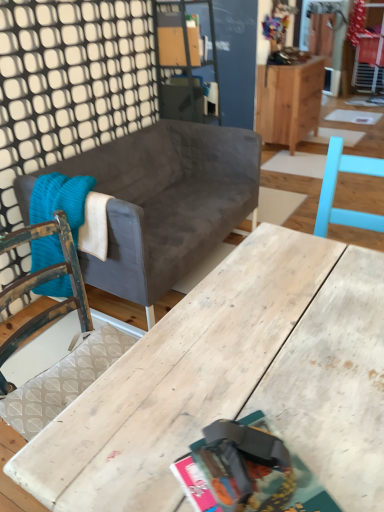
Question: From a real-world perspective, is wooden cabinet at upper right positioned over velvet gray couch at center based on gravity?

Choices:
 (A) no
 (B) yes

Answer: (B)

Question: Is wooden cabinet at upper right to the right of velvet gray couch at center from the viewer's perspective?

Choices:
 (A) no
 (B) yes

Answer: (B)

Question: From the image's perspective, is wooden cabinet at upper right located beneath velvet gray couch at center?

Choices:
 (A) yes
 (B) no

Answer: (B)

Question: Considering the relative sizes of wooden cabinet at upper right and velvet gray couch at center in the image provided, is wooden cabinet at upper right smaller than velvet gray couch at center?

Choices:
 (A) no
 (B) yes

Answer: (B)

Question: Is wooden cabinet at upper right aimed at velvet gray couch at center?

Choices:
 (A) yes
 (B) no

Answer: (B)

Question: From their relative heights in the image, would you say matte paper magazine at center is taller or shorter than wooden cabinet at upper right?

Choices:
 (A) tall
 (B) short

Answer: (B)

Question: Which is correct: matte paper magazine at center is inside wooden cabinet at upper right, or outside of it?

Choices:
 (A) outside
 (B) inside

Answer: (A)

Question: Does point (258, 423) appear closer or farther from the camera than point (268, 86)?

Choices:
 (A) closer
 (B) farther

Answer: (A)

Question: From the image's perspective, is matte paper magazine at center above or below wooden cabinet at upper right?

Choices:
 (A) below
 (B) above

Answer: (A)

Question: Considering the relative positions of knitted wool blanket at left and wooden table at center in the image provided, is knitted wool blanket at left to the left or to the right of wooden table at center?

Choices:
 (A) right
 (B) left

Answer: (B)

Question: Considering their positions, is knitted wool blanket at left located in front of or behind wooden table at center?

Choices:
 (A) behind
 (B) front

Answer: (A)

Question: From the image's perspective, is knitted wool blanket at left positioned above or below wooden table at center?

Choices:
 (A) above
 (B) below

Answer: (A)

Question: From a real-world perspective, is knitted wool blanket at left above or below wooden table at center?

Choices:
 (A) above
 (B) below

Answer: (A)

Question: Considering the positions of point (306, 133) and point (236, 159), is point (306, 133) closer or farther from the camera than point (236, 159)?

Choices:
 (A) closer
 (B) farther

Answer: (B)

Question: Looking at the image, does wooden cabinet at upper right seem bigger or smaller compared to velvet gray couch at center?

Choices:
 (A) big
 (B) small

Answer: (B)